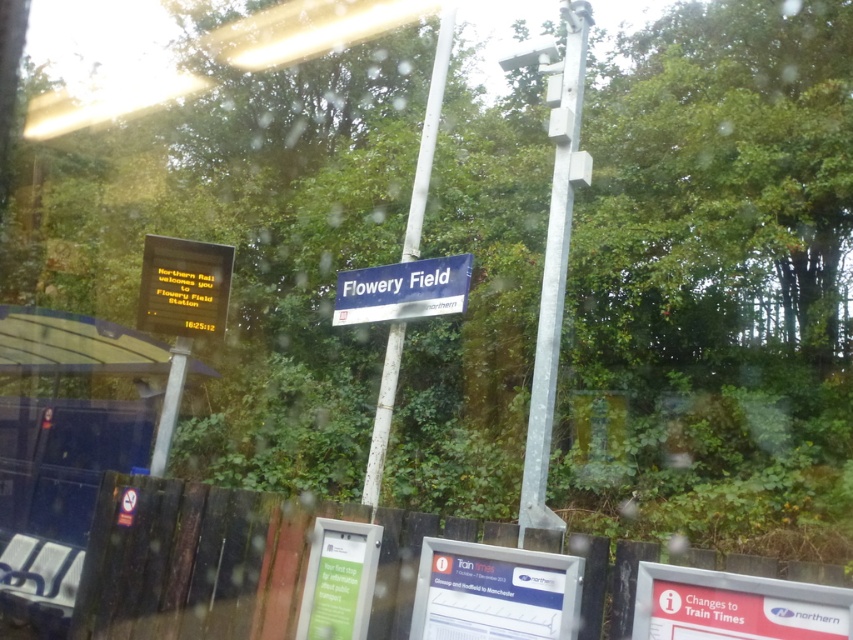
Question: Which object is closer to the camera taking this photo?

Choices:
 (A) wooden bench at left
 (B) galvanized metal pole at upper right

Answer: (B)

Question: Which object appears closest to the camera in this image?

Choices:
 (A) white plastic sign at lower right
 (B) yellow digital display at upper left

Answer: (A)

Question: Can you confirm if white plastic sign at lower right is positioned below blue metallic signboard at center?

Choices:
 (A) no
 (B) yes

Answer: (B)

Question: Is blue metallic signboard at center to the right of white painted metal pole at center from the viewer's perspective?

Choices:
 (A) yes
 (B) no

Answer: (A)

Question: Which object is positioned closest to the galvanized metal pole at upper right?

Choices:
 (A) white painted metal pole at center
 (B) yellow digital display at upper left
 (C) white plastic sign at center
 (D) wooden bench at left

Answer: (C)

Question: Can you confirm if galvanized metal pole at upper right is positioned below blue metallic signboard at center?

Choices:
 (A) yes
 (B) no

Answer: (B)